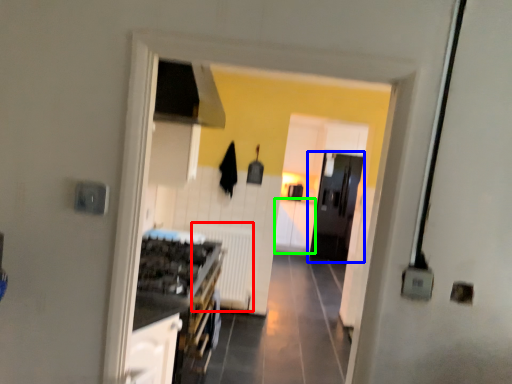
Question: Which object is positioned farthest from radiator (highlighted by a red box)? Select from door (highlighted by a blue box) and cabinetry (highlighted by a green box).

Choices:
 (A) door
 (B) cabinetry

Answer: (B)